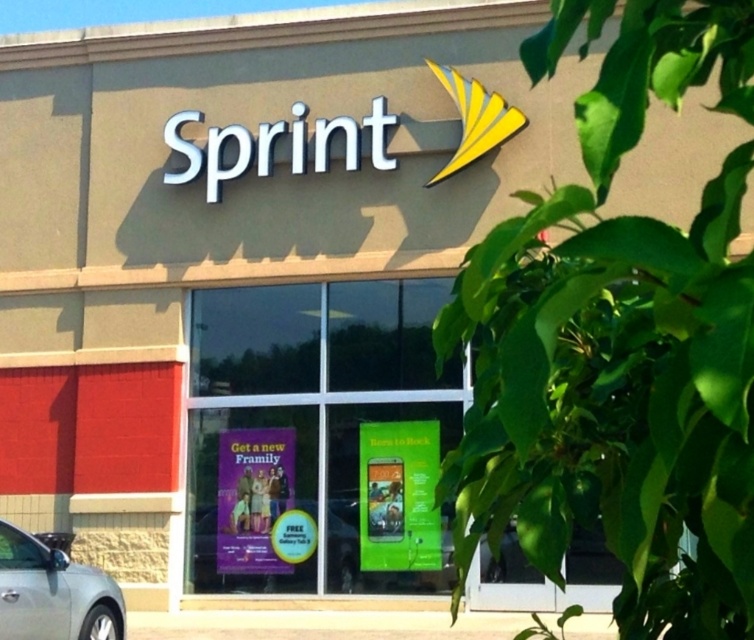
You are a delivery person approaching the Sprint store entrance. You notice a silver metallic car at lower left and a purple glossy poster at lower center. Which object is shorter in height?

The silver metallic car at lower left is shorter in height compared to the purple glossy poster at lower center.

You are a customer approaching the Sprint store entrance. You see a silver metallic car at lower left and a purple glossy poster at lower center. Which object is closer to you as you approach the entrance?

The silver metallic car at lower left is closer to you because it is in front of the purple glossy poster at lower center.